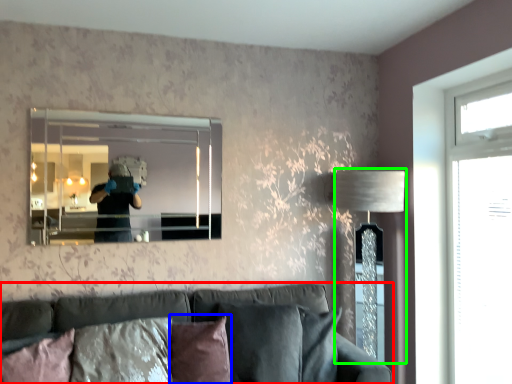
Question: Estimate the real-world distances between objects in this image. Which object is farther from studio couch (highlighted by a red box), pillow (highlighted by a blue box) or table lamp (highlighted by a green box)?

Choices:
 (A) pillow
 (B) table lamp

Answer: (B)